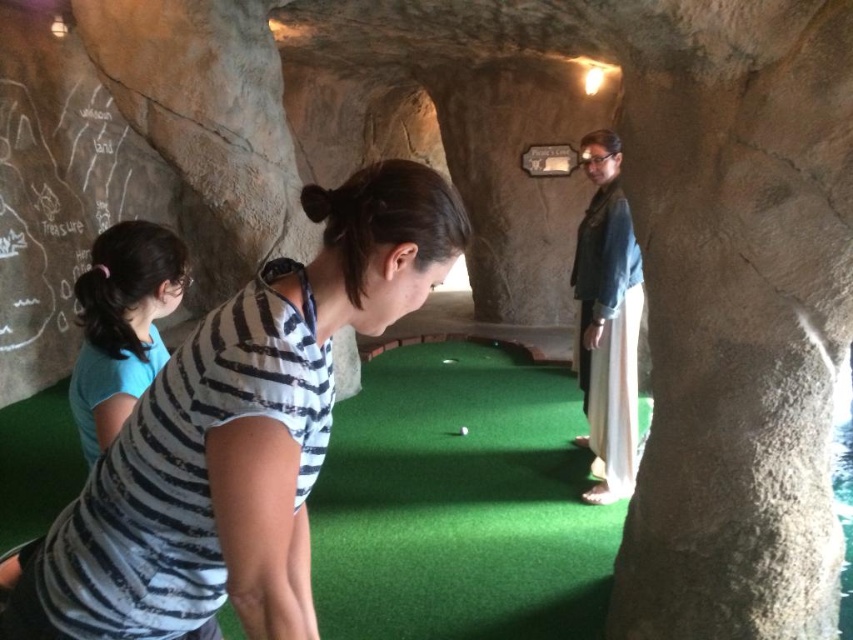
You are a miniature golf player standing at the tee. You see the striped fabric shirt at center and the denim jacket at right. Which piece of clothing is closer to the ground?

The striped fabric shirt at center is positioned under the denim jacket at right, meaning it is closer to the ground.

Looking at this image, you are playing miniature golf in this cave setting and want to hit the ball to the hole located at point (265, 378). The ball is currently 30 inches away from the camera. Can you reach the hole with one shot?

The point (265, 378) is 37.54 inches away from the camera. Since the ball is only 30 inches away, you need to hit the ball 7.54 inches further to reach the hole.